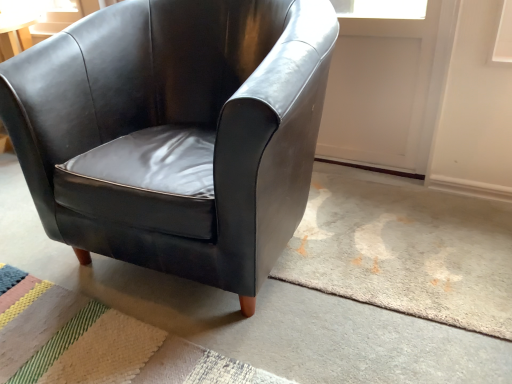
Locate an element on the screen. The height and width of the screenshot is (384, 512). blank space situated above textured beige rug at lower left (from a real-world perspective) is located at coordinates [x=94, y=347].